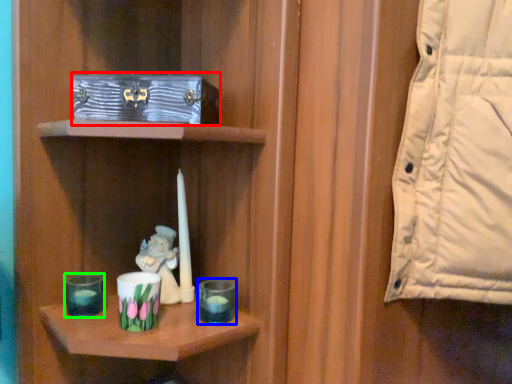
Question: Which is farther away from box (highlighted by a red box)? candle holder (highlighted by a blue box) or candle holder (highlighted by a green box)?

Choices:
 (A) candle holder
 (B) candle holder

Answer: (B)